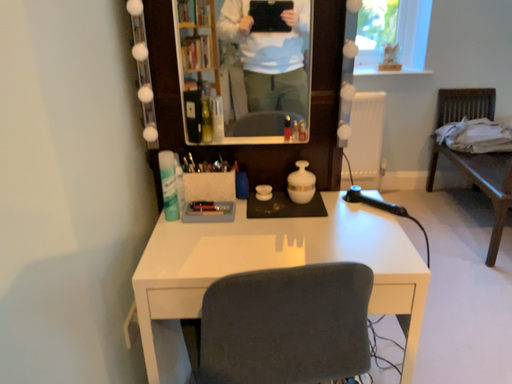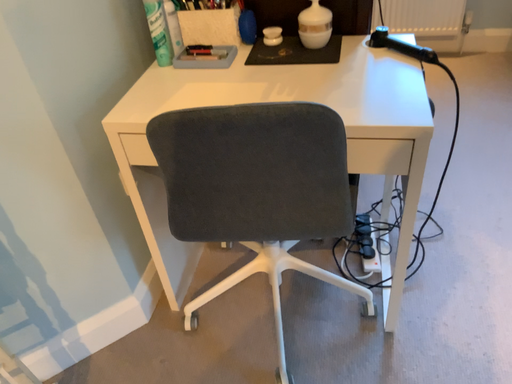
Question: How did the camera likely rotate when shooting the video?

Choices:
 (A) rotated right
 (B) rotated left

Answer: (B)